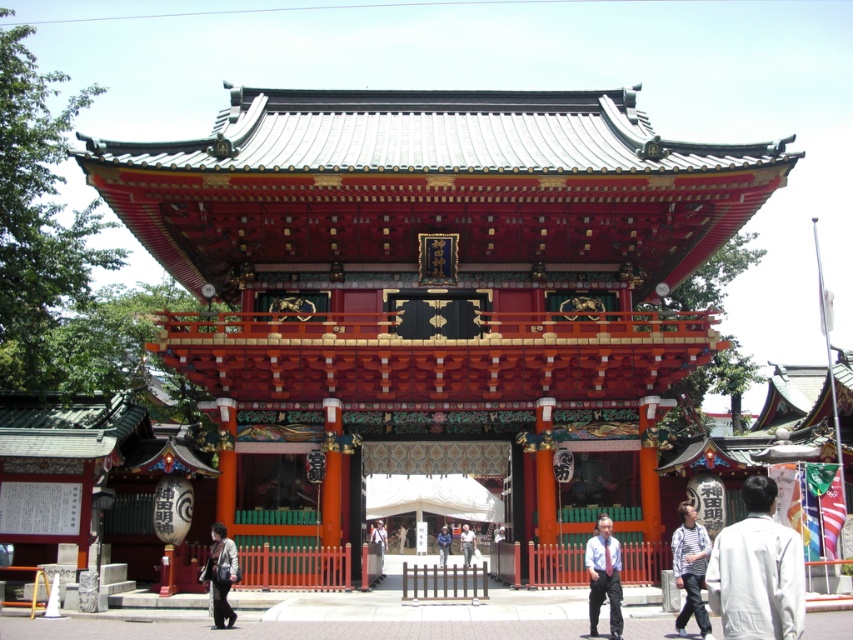
You are a visitor at the shrine and want to take a photo of the shrine while also including both the white shirt at center and the matte black jacket at lower left. Which object should you focus on first to ensure both are in the frame?

You should focus on the white shirt at center first because it is above the matte black jacket at lower left, so by centering the camera on the white shirt at center, you can adjust the framing to include the matte black jacket at lower left below it.

You are standing in front of the shrine and want to determine which of the two points, point (555,115) or point (705,620), is closer to you. Based on the shrine structure, which point is nearer?

Point (555,115) is further to the camera than point (705,620). Wait, no, the description says the first point is further to the camera, so the second point is closer. Therefore, point (705,620) is closer to you.